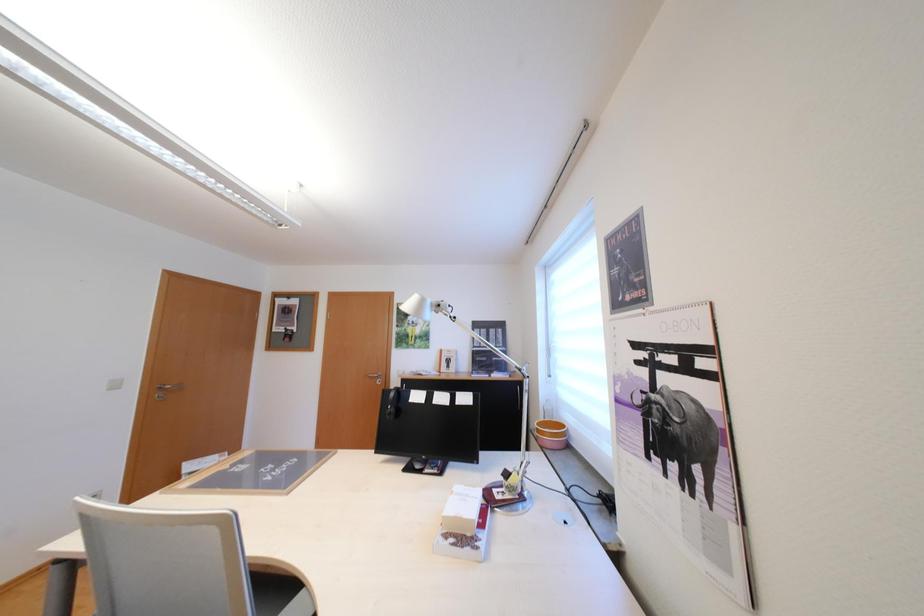
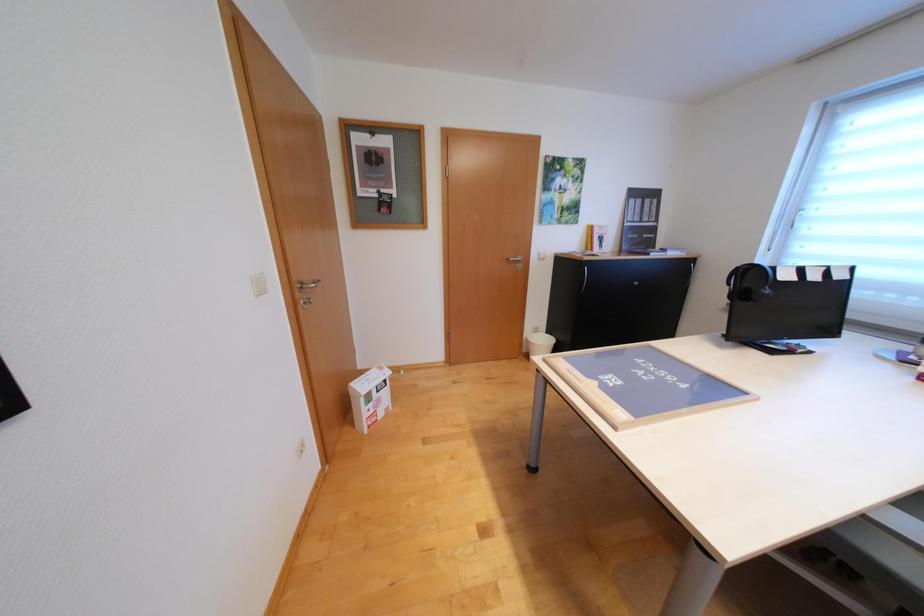
The images are taken continuously from a first-person perspective. In which direction are you moving?

The cameraman walked toward left, forward.